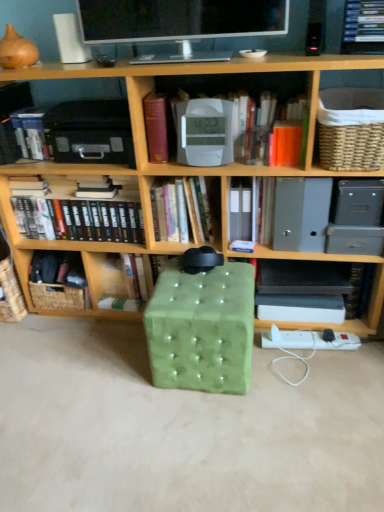
This screenshot has height=512, width=384. What are the coordinates of `vacant area that is in front of woven brown basket at lower left, which is the second basket in front-to-back order` in the screenshot? It's located at (x=65, y=332).